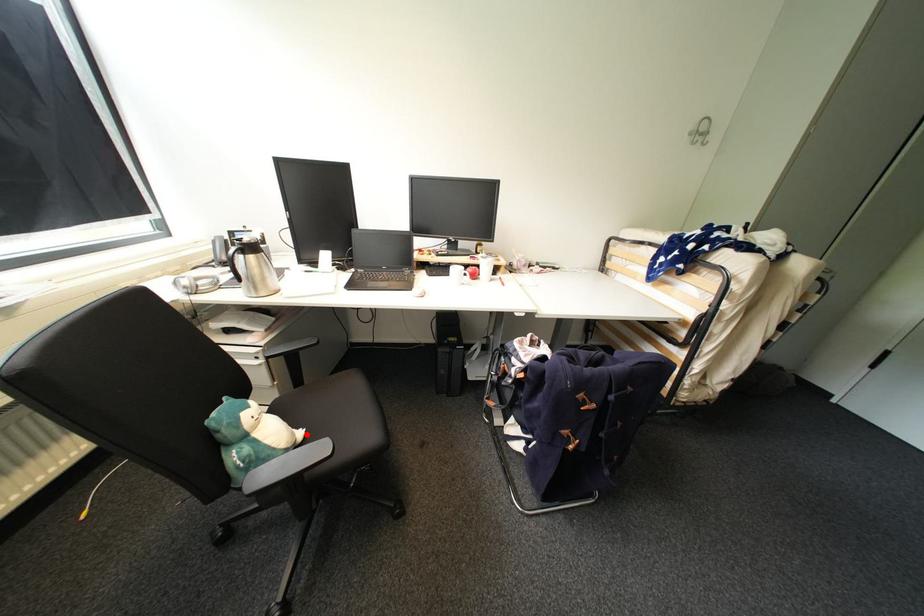
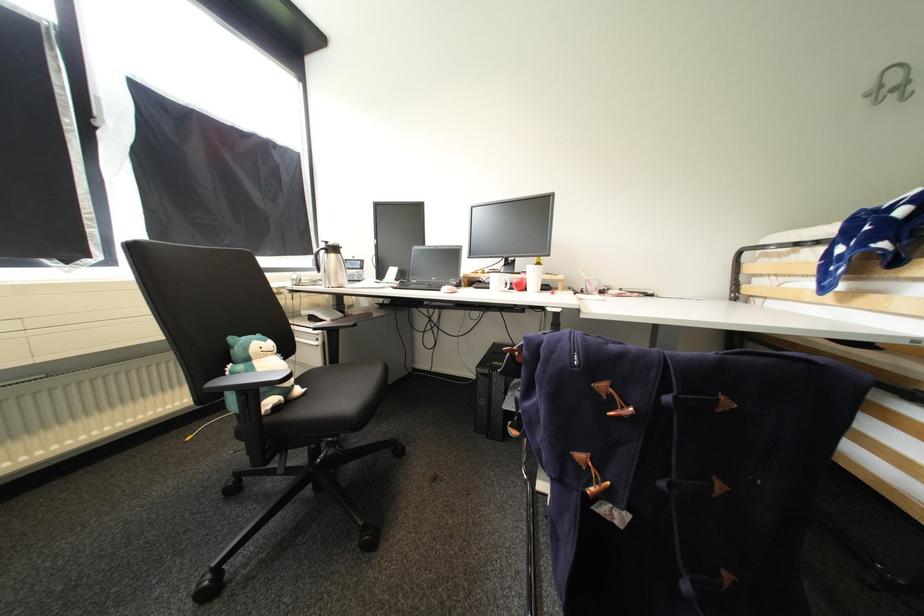
In the second image, find the point that corresponds to the highlighted location in the first image.

(306, 391)